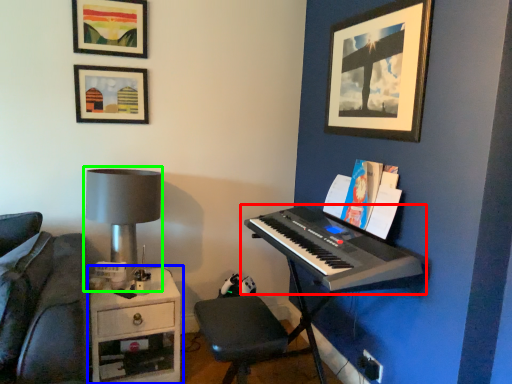
Question: Which is nearer to the musical keyboard (highlighted by a red box)? table (highlighted by a blue box) or table lamp (highlighted by a green box).

Choices:
 (A) table
 (B) table lamp

Answer: (B)